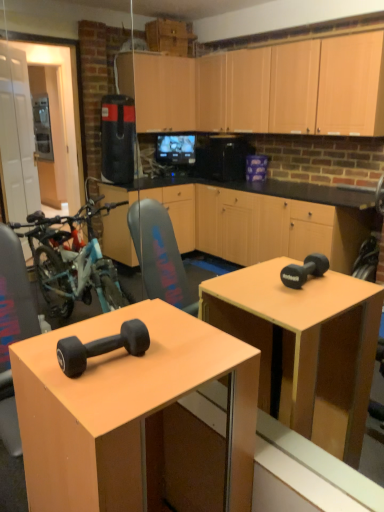
You are a GUI agent. You are given a task and a screenshot of the screen. Output one action in this format:
    pyautogui.click(x=<x>, y=<y>)
    Task: Click on the vacant space to the right of black rubber dumbbell at lower left
    Image resolution: width=384 pixels, height=512 pixels.
    Given the screenshot: What is the action you would take?
    pyautogui.click(x=168, y=360)